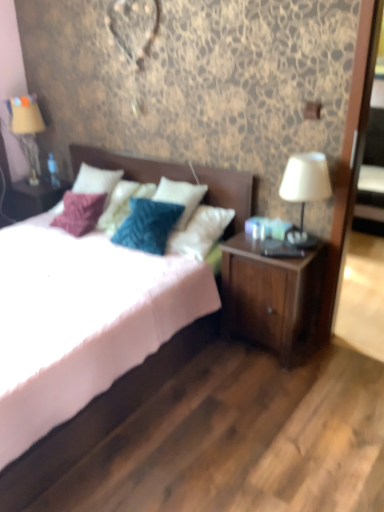
This screenshot has width=384, height=512. I want to click on vacant location below white fabric lampshade at right, arranged as the second table lamp when viewed from the top (from a real-world perspective), so click(299, 239).